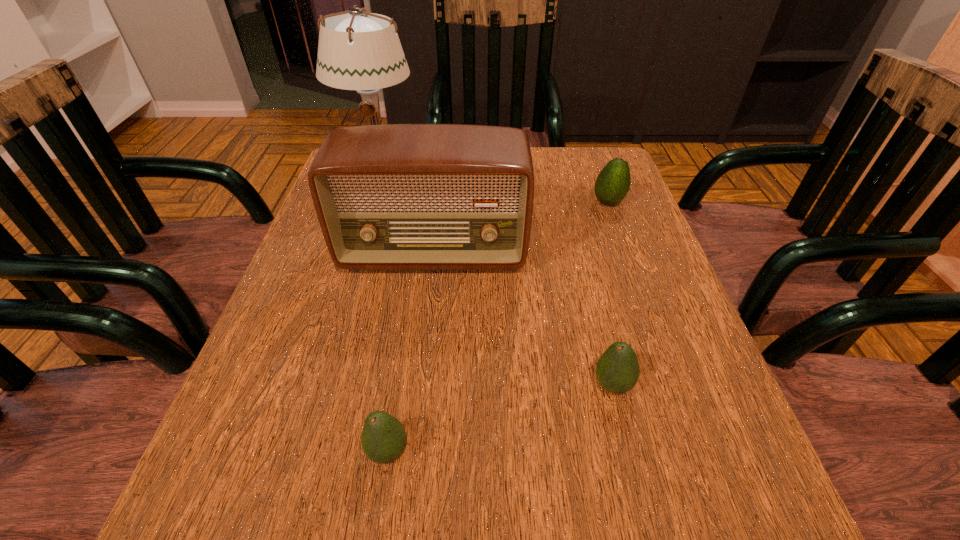
You are a GUI agent. You are given a task and a screenshot of the screen. Output one action in this format:
    pyautogui.click(x=<x>, y=<y>)
    Task: Click on the vacant point located 0.230m on the lampshade of the lampshade
    The width and height of the screenshot is (960, 540).
    Given the screenshot: What is the action you would take?
    [x=354, y=252]

You are a GUI agent. You are given a task and a screenshot of the screen. Output one action in this format:
    pyautogui.click(x=<x>, y=<y>)
    Task: Click on the free space located on the front-facing side of the second tallest object
    
    Given the screenshot: What is the action you would take?
    pyautogui.click(x=427, y=309)

Image resolution: width=960 pixels, height=540 pixels. In order to click on vacant space situated 0.050m on the left of the rightmost object in this screenshot , I will do `click(570, 202)`.

Locate an element on the screen. The image size is (960, 540). free space located 0.170m on the back of the second avocado from right to left is located at coordinates (589, 292).

Where is `free space located 0.150m on the back of the nearest avocado`? free space located 0.150m on the back of the nearest avocado is located at coordinates (404, 347).

This screenshot has height=540, width=960. I want to click on lampshade that is at the far edge, so click(x=357, y=50).

Locate an element on the screen. This screenshot has height=540, width=960. avocado that is at the far edge is located at coordinates (613, 182).

Where is `lampshade present at the left edge`? This screenshot has height=540, width=960. lampshade present at the left edge is located at coordinates (357, 50).

Where is `radio receiver present at the left edge`? The height and width of the screenshot is (540, 960). radio receiver present at the left edge is located at coordinates (399, 196).

This screenshot has height=540, width=960. I want to click on object situated at the far left corner, so click(357, 50).